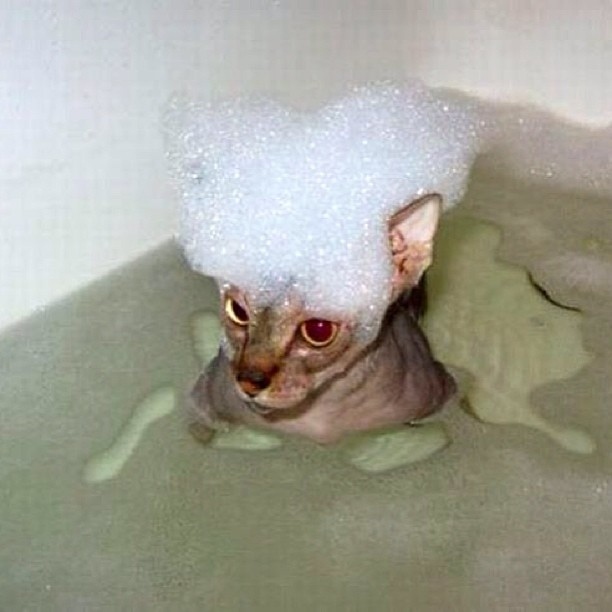
Where is `bathtub wall`? bathtub wall is located at coordinates (125, 61).